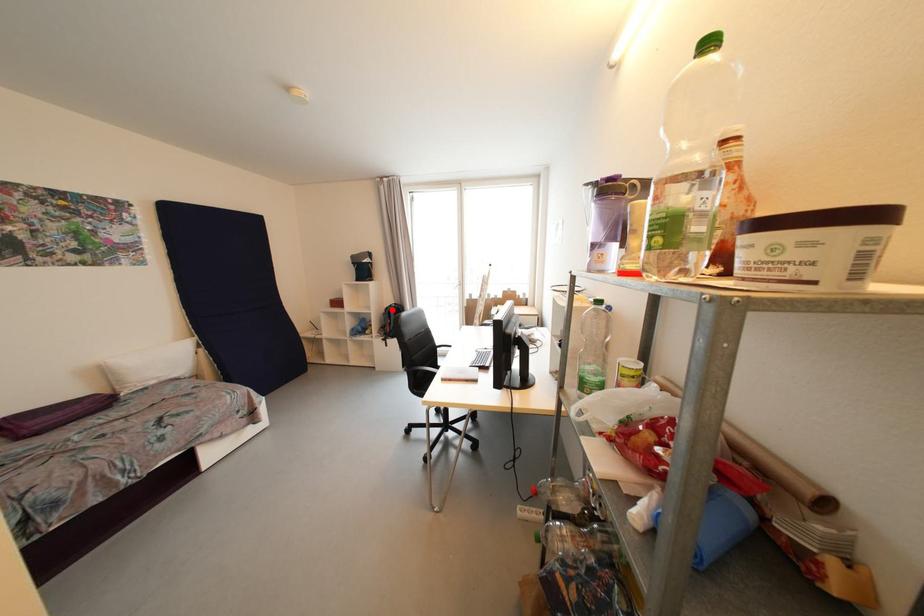
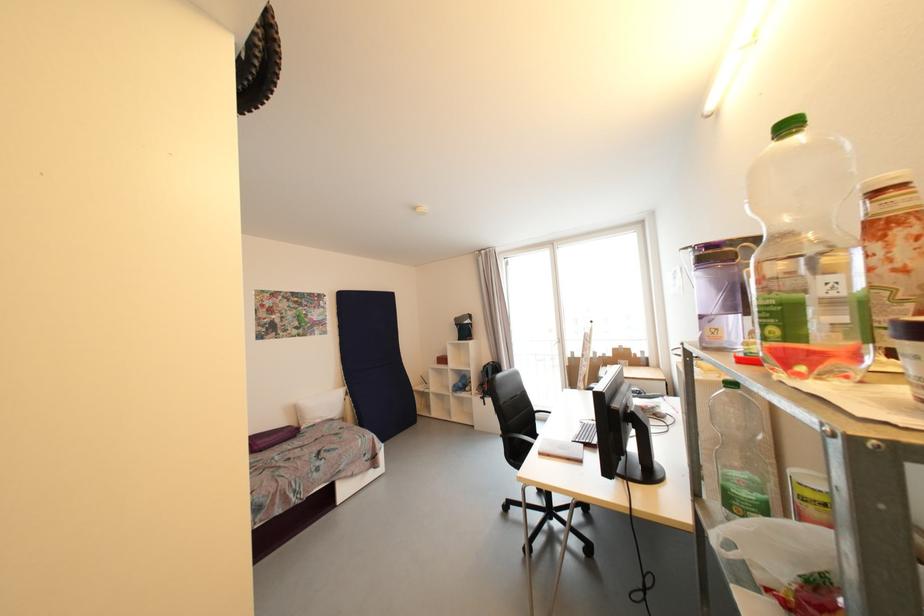
Question: I am providing you with two images of the same scene from different viewpoints. A red point is shown in image1. For the corresponding object point in image2, is it positioned nearer or farther from the camera?

Choices:
 (A) Nearer
 (B) Farther

Answer: (A)